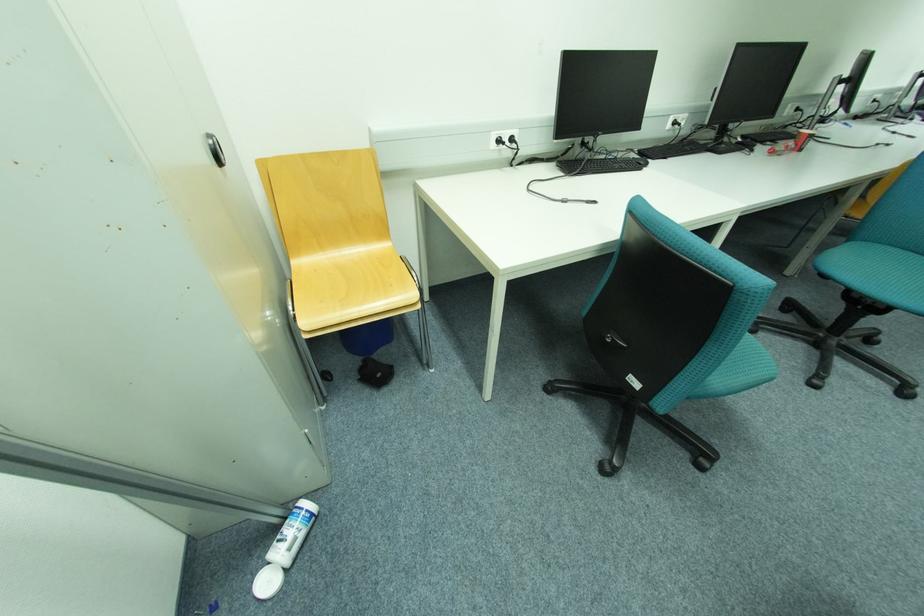
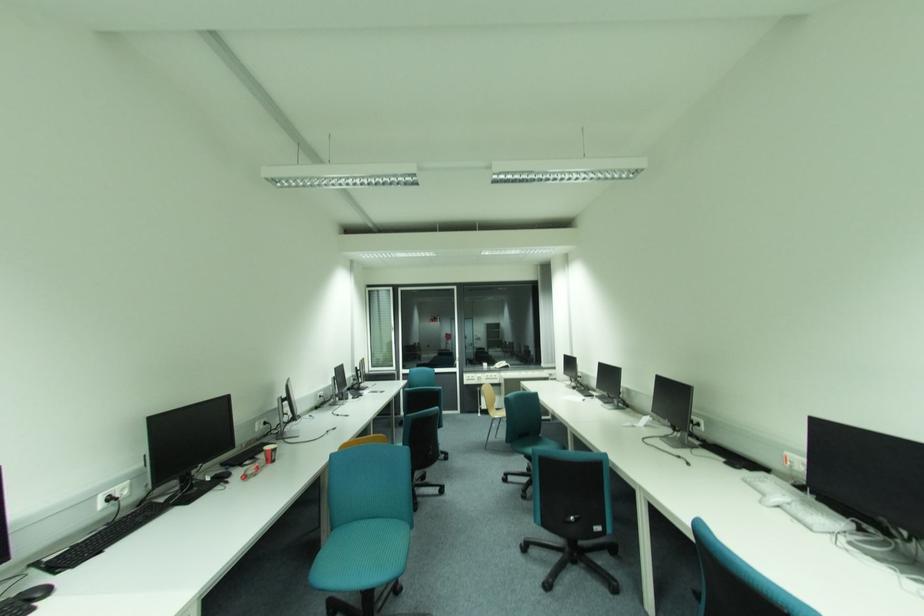
How did the camera likely rotate?

The camera rotated toward right-up.